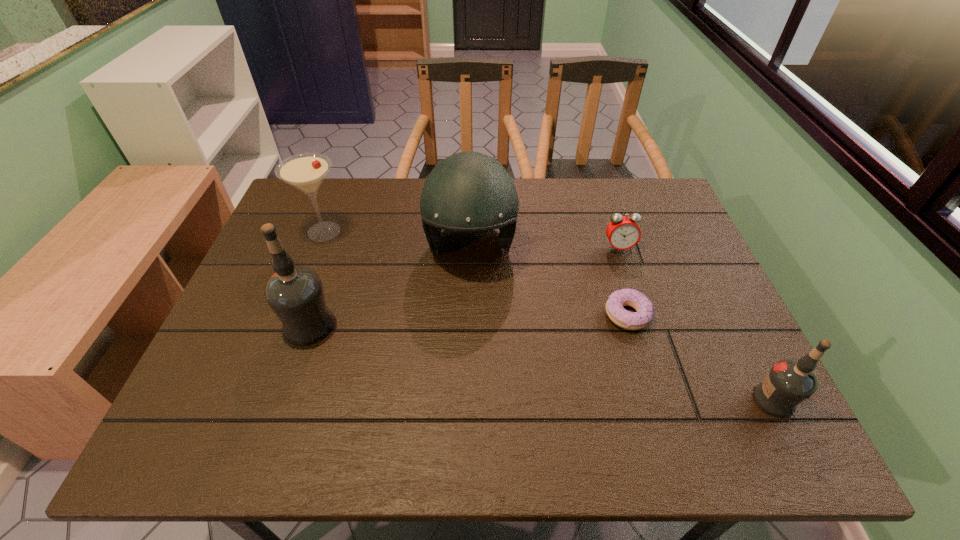
The width and height of the screenshot is (960, 540). Identify the location of vacant space at the near right corner. (706, 382).

Where is `vacant space that's between the martini and the alarm clock`? The width and height of the screenshot is (960, 540). vacant space that's between the martini and the alarm clock is located at coordinates (471, 240).

Find the location of a particular element. The height and width of the screenshot is (540, 960). free space between the fifth tallest object and the nearest object is located at coordinates (696, 324).

The height and width of the screenshot is (540, 960). I want to click on empty location between the alarm clock and the shorter vodka, so click(696, 324).

Locate an element on the screen. This screenshot has width=960, height=540. unoccupied position between the shortest object and the martini is located at coordinates (476, 273).

Image resolution: width=960 pixels, height=540 pixels. In order to click on free space between the martini and the fifth tallest object in this screenshot , I will do `click(471, 240)`.

Image resolution: width=960 pixels, height=540 pixels. What are the coordinates of `vacant space in between the nearest object and the fifth tallest object` in the screenshot? It's located at (696, 324).

You are a GUI agent. You are given a task and a screenshot of the screen. Output one action in this format:
    pyautogui.click(x=<x>, y=<y>)
    Task: Click on the free spot between the fourth object from right to left and the martini
    This screenshot has width=960, height=540.
    Given the screenshot: What is the action you would take?
    pyautogui.click(x=397, y=239)

This screenshot has width=960, height=540. In order to click on vacant space in between the taller vodka and the second shortest object in this screenshot , I will do `click(464, 286)`.

This screenshot has width=960, height=540. What are the coordinates of `free space between the martini and the right vodka` in the screenshot? It's located at (549, 316).